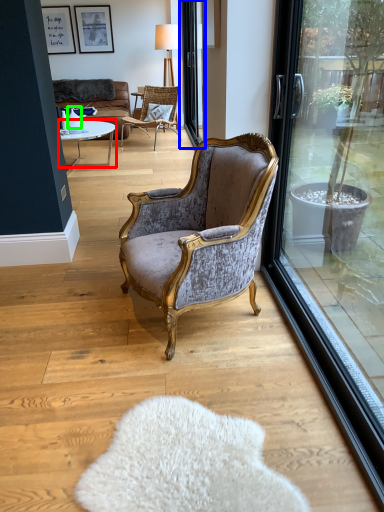
Question: Considering the real-world distances, which object is farthest from coffee table (highlighted by a red box)? screen door (highlighted by a blue box) or vase (highlighted by a green box)?

Choices:
 (A) screen door
 (B) vase

Answer: (A)